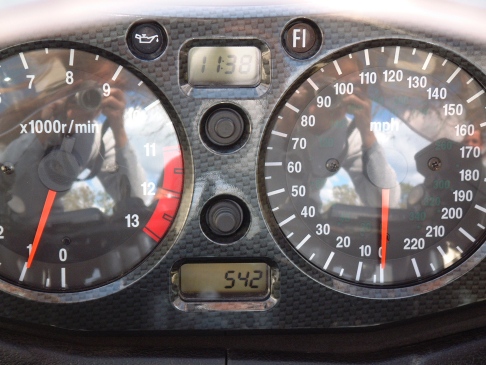
The width and height of the screenshot is (486, 365). Find the location of `digital display`. digital display is located at coordinates point(245,76), point(211,264).